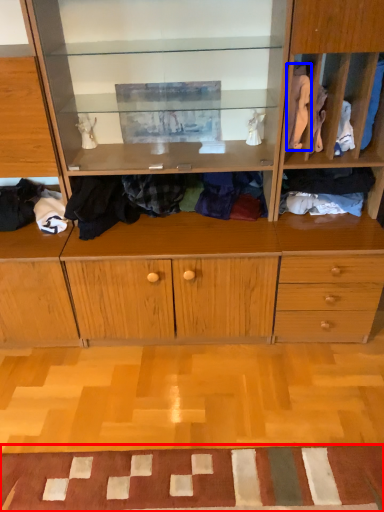
Question: Which object is further to the camera taking this photo, doormat (highlighted by a red box) or clothing (highlighted by a blue box)?

Choices:
 (A) doormat
 (B) clothing

Answer: (B)